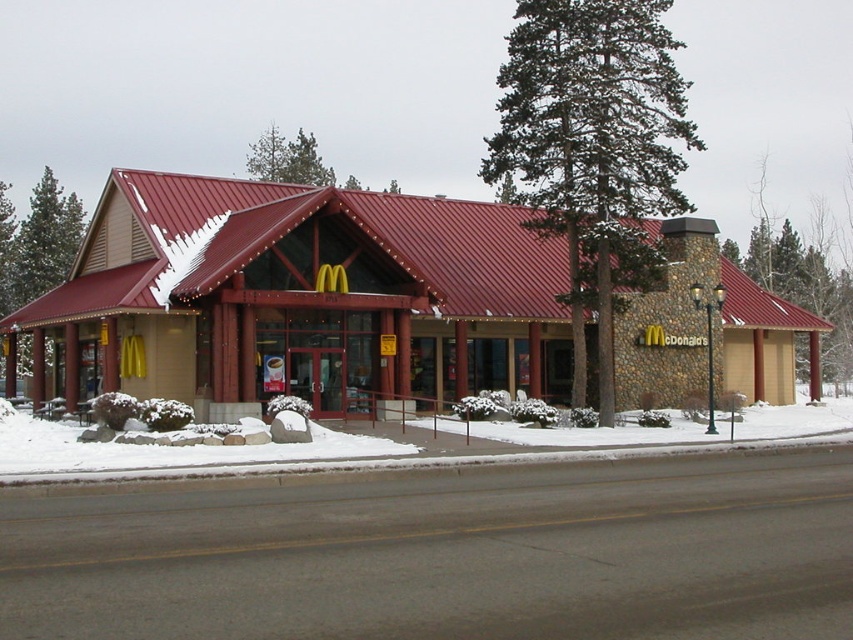
You are planning to place a new bench in front of the McDonalds restaurant. The bench is 1 meter wide. Which tree should you place it closer to if you want to ensure there is enough space between the bench and the tree? Please choose between the green coniferous tree at center and the green leafy tree at left.

The green coniferous tree at center has a smaller width compared to the green leafy tree at left. Therefore, placing the bench closer to the green coniferous tree at center would leave more space between the bench and the tree, ensuring adequate clearance.

Consider the image. You are a landscape architect designing a path between the green textured tree at right and the green leafy tree at left. Which tree requires a narrower path due to its smaller width?

The green textured tree at right requires a narrower path because its width is less than the green leafy tree at left.